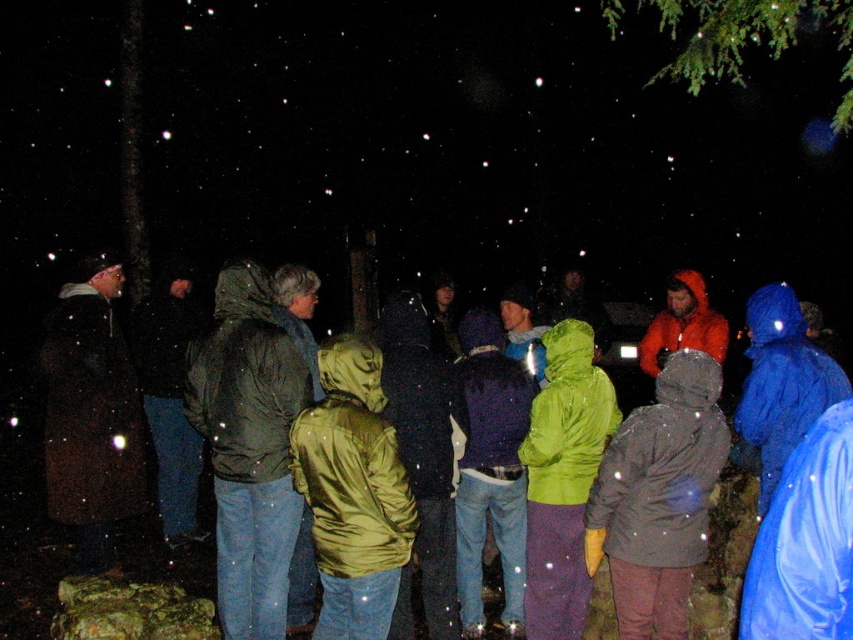
You are standing in the forest at night and see the green leafy branch at upper right and the orange waterproof jacket at center. Which object is positioned more to the right side of the scene?

The green leafy branch at upper right is positioned more to the right side of the scene than the orange waterproof jacket at center.

You are standing in the forest scene and want to move from the matte green jacket at center to the green leafy branch at upper right. Which direction should you move to reach the branch?

The matte green jacket at center is positioned on the left side of the green leafy branch at upper right, so you should move to the right to reach the branch.

You are a photographer trying to capture a clear shot of the matte green jacket at center and the green leafy branch at upper right. Since the lighting is dim, you want to ensure both subjects are well illuminated. Which object should you focus on first if you want to capture the one that is closer to the camera?

The matte green jacket at center is shorter than the green leafy branch at upper right, so the matte green jacket at center is closer to the camera. Therefore, you should focus on the matte green jacket at center first to ensure proper illumination.